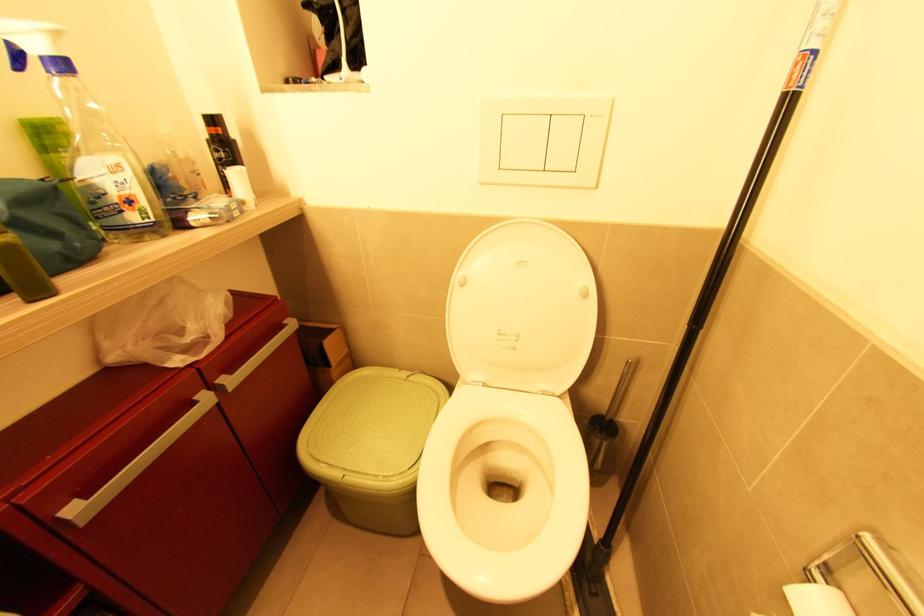
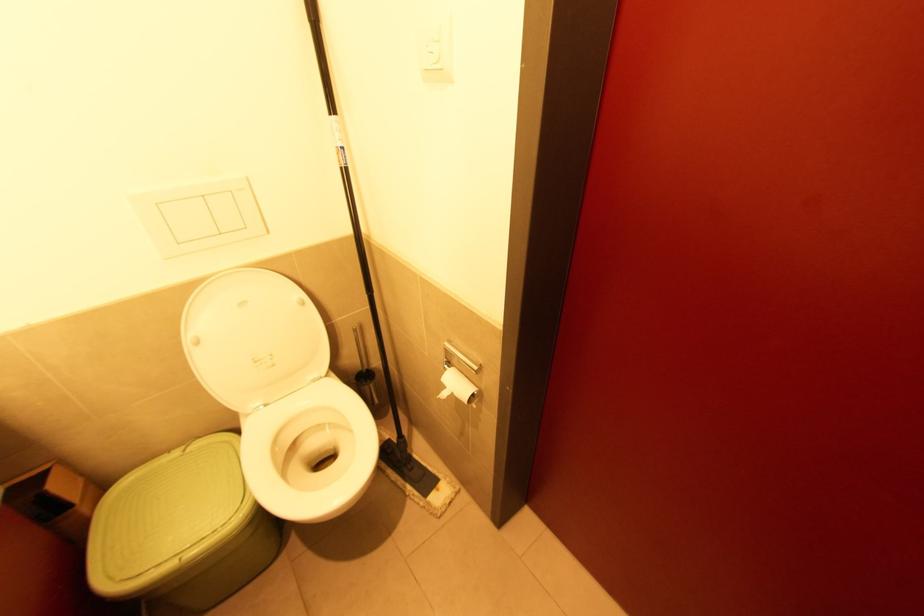
In the second image, find the point that corresponds to point 563,398 in the first image.

(329, 377)